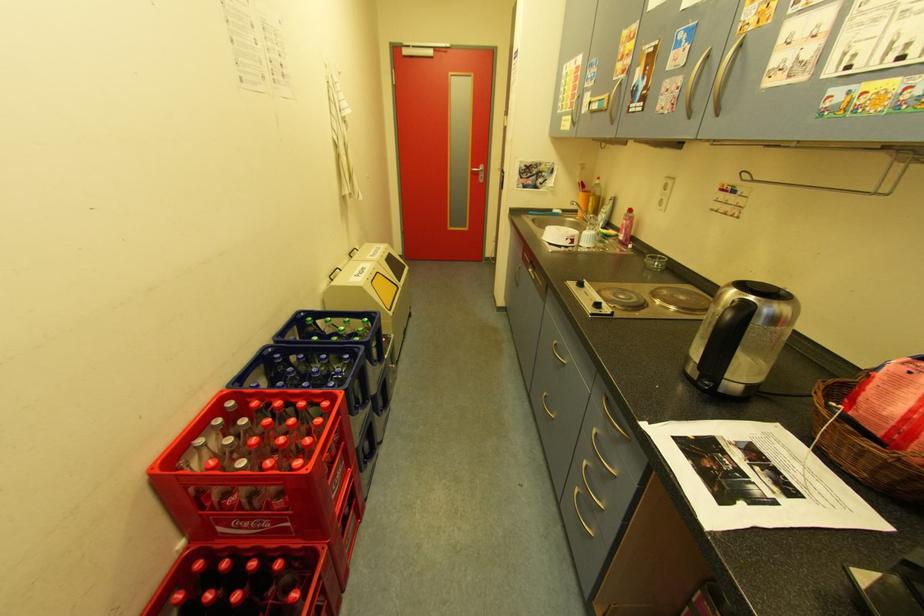
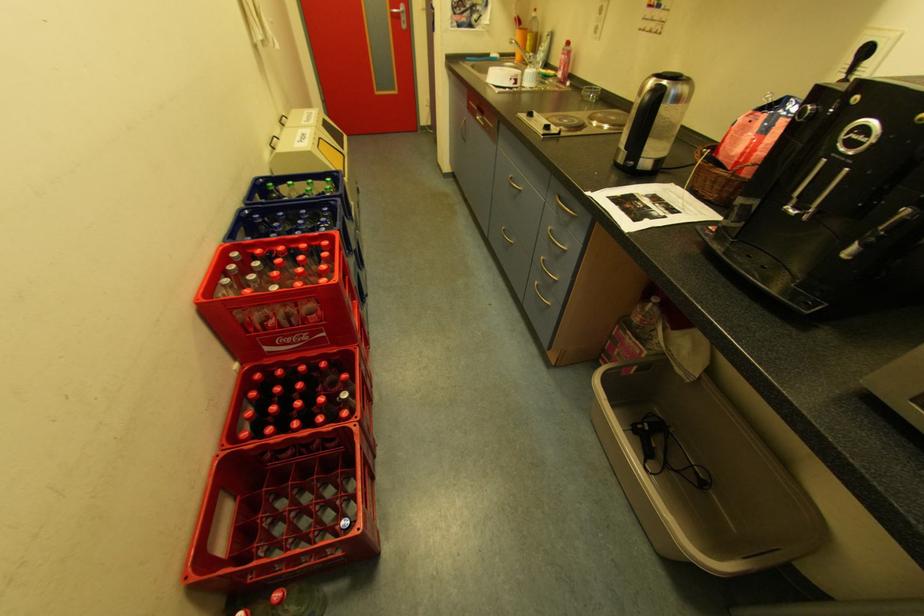
The images are taken continuously from a first-person perspective. In which direction are you moving?

The cameraman moved toward left, backward.